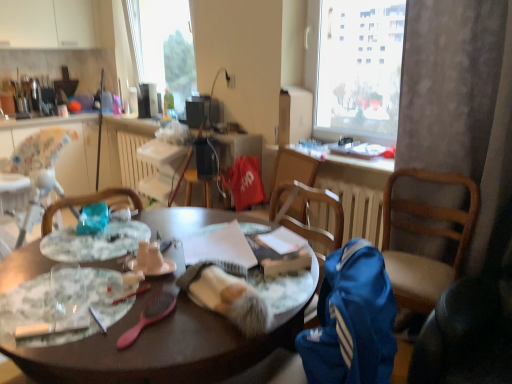
Find the location of a particular element. vacant area on top of translucent glass plate at center, the 1th plate in the back-to-front sequence (from a real-world perspective) is located at coordinates (97, 236).